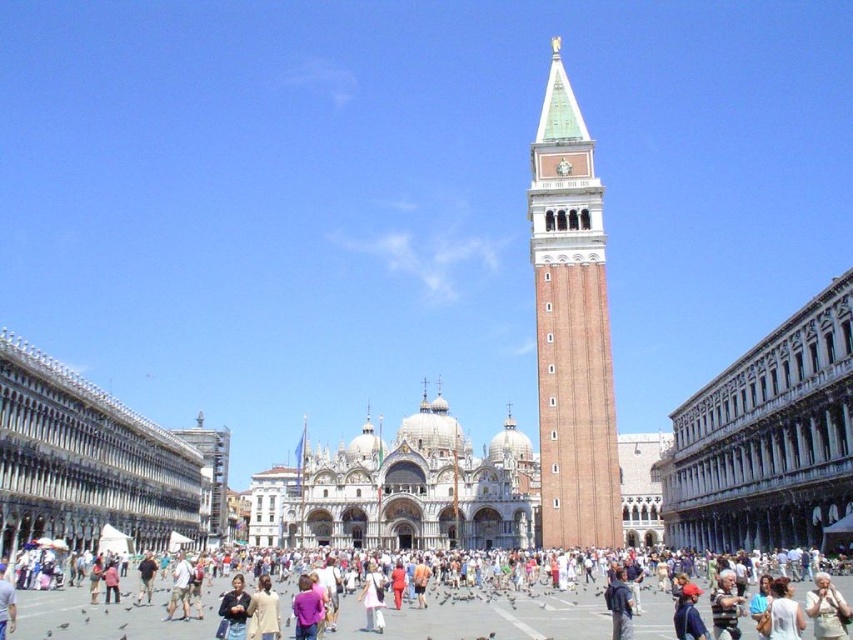
You are a tourist standing in St. Mark Square in Venice and you see the brown brick tower at center and the dark blue sweater at center. Which object is located to the right of the other?

The brown brick tower at center is positioned on the right side of dark blue sweater at center, so the brown brick tower at center is to the right of the dark blue sweater at center.

You are standing at the entrance of St. Mark Square and want to take a photo of the brown brick tower at center. Where should you position yourself to capture it in the frame?

The brown brick tower at center is located at coordinates point (x=572, y=328), so you should position yourself facing the center of the square to capture it in the frame.

You are standing at the entrance of St. Mark Square and see two points marked on the ground. The first point is at coordinate point (154, 616) and the second is at point (225, 611). Which point is closer to you?

Point (154, 616) is closer to you because it is further to the viewer than point (225, 611).